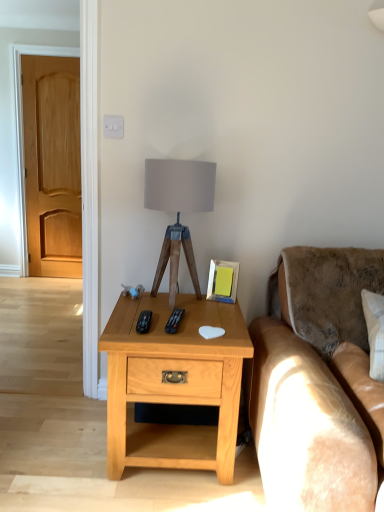
Where is `free point in front of metallic silver picture frame at upper right`? The width and height of the screenshot is (384, 512). free point in front of metallic silver picture frame at upper right is located at coordinates (222, 312).